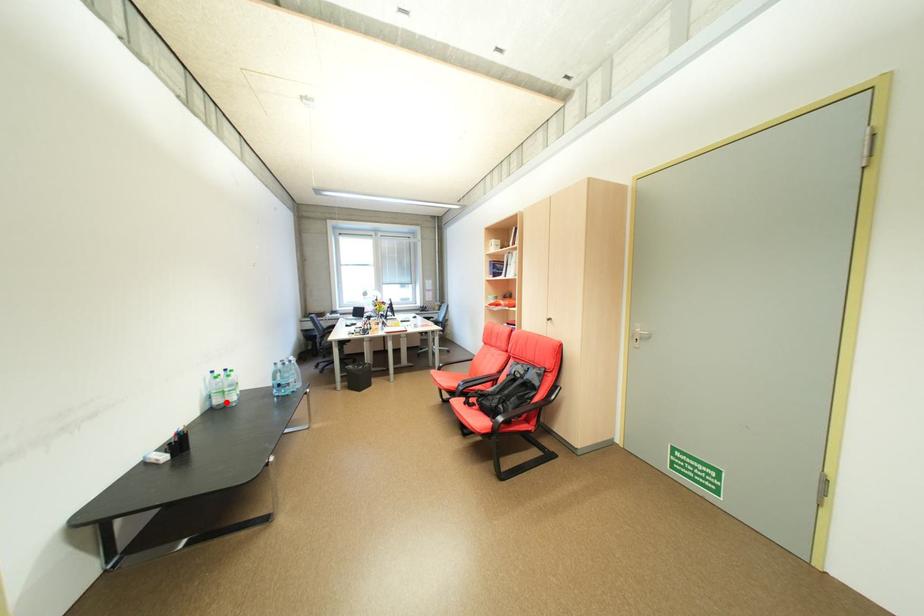
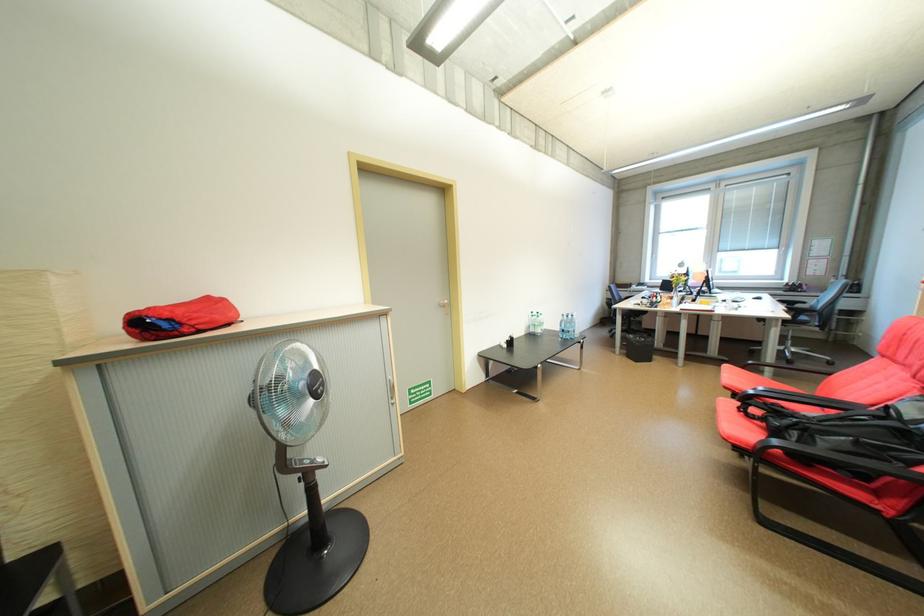
In the second image, find the point that corresponds to the highlighted location in the first image.

(541, 331)